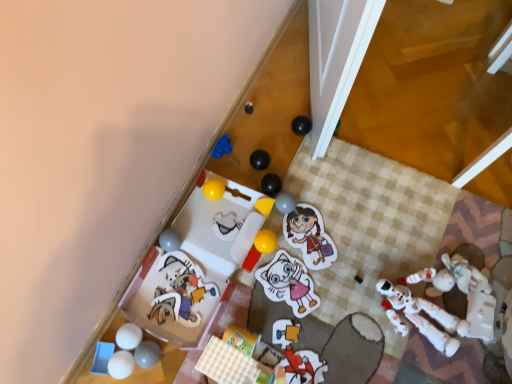
Where is `free location to the right of rubber matte ball at center, which ranks as the thirteenth toy in left-to-right order`? free location to the right of rubber matte ball at center, which ranks as the thirteenth toy in left-to-right order is located at coordinates (334, 214).